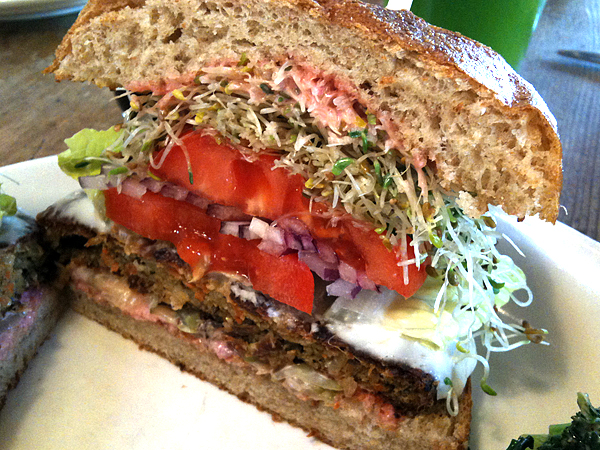
Locate an element on the screen. The height and width of the screenshot is (450, 600). plate is located at coordinates (546, 392).